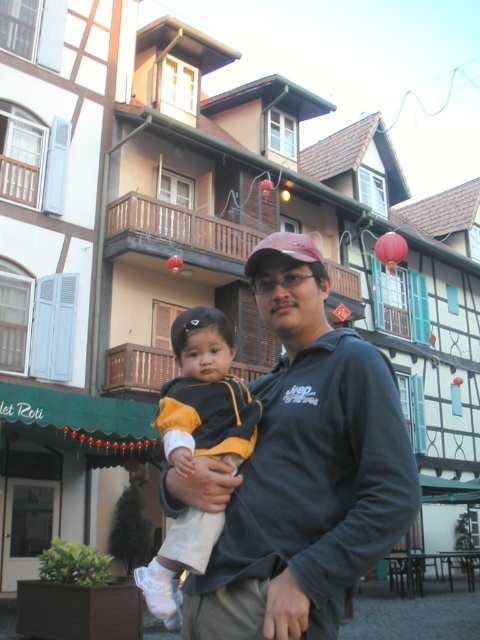
A photographer wants to capture both the man and the child in a single frame without moving the camera. Given that the camera has a 50mm lens with a field of view of 46 degrees, can they both fit in the frame if the photographer is standing at the point marked by the coordinates point at (352, 445)?

The man and the child are 37.49 feet apart. With a 50mm lens providing a 46 degree field of view, the maximum distance that can be captured in the frame is approximately 37.49 feet or less. Since the distance between them matches the field of view, they can both fit in the frame.

You are standing in front of the buildings and want to place a small flowerpot between the two points marked as point (300,515) and point (202,380). Which point should the flowerpot be closer to in order to be nearer to the viewer?

→ The flowerpot should be placed closer to point (300,515) because it is closer to the viewer than point (202,380).

You are a photographer trying to capture a candid shot of the man and child. The camera you are using has a limited field of view. To ensure both the dark gray sweatshirt at center and the matte pink baseball cap at center are fully visible in the frame, which object should you focus on to adjust the camera angle?

You should focus on the matte pink baseball cap at center because the dark gray sweatshirt at center is shorter than it. Since the baseball cap is taller, adjusting the camera angle to include it will automatically ensure the shorter sweatshirt is also in view.